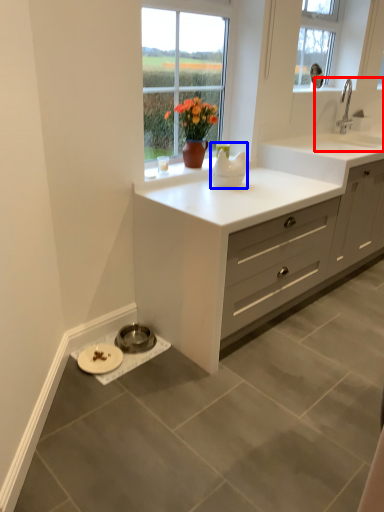
Question: Which point is closer to the camera, sink (highlighted by a red box) or appliance (highlighted by a blue box)?

Choices:
 (A) sink
 (B) appliance

Answer: (B)